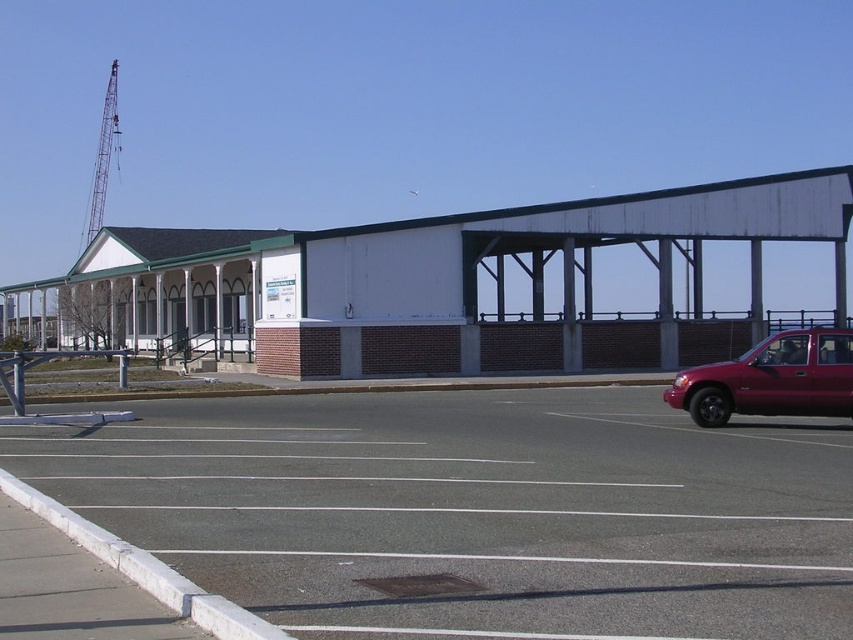
Question: Can you confirm if gray asphalt parking lot at lower right is wider than glossy red truck at right?

Choices:
 (A) yes
 (B) no

Answer: (A)

Question: Among these objects, which one is farthest from the camera?

Choices:
 (A) glossy red truck at right
 (B) gray asphalt parking lot at lower right

Answer: (A)

Question: Is gray asphalt parking lot at lower right to the left of glossy red truck at right from the viewer's perspective?

Choices:
 (A) yes
 (B) no

Answer: (A)

Question: Which object appears closest to the camera in this image?

Choices:
 (A) gray asphalt parking lot at lower right
 (B) glossy red truck at right

Answer: (A)

Question: Which of the following is the closest to the observer?

Choices:
 (A) glossy red truck at right
 (B) gray asphalt parking lot at lower right

Answer: (B)

Question: Is gray asphalt parking lot at lower right below glossy red truck at right?

Choices:
 (A) yes
 (B) no

Answer: (A)